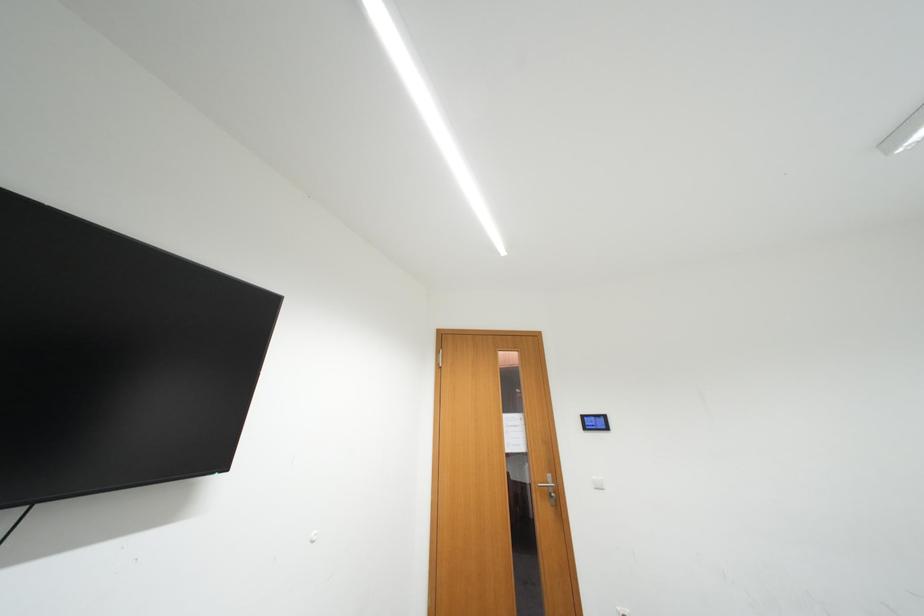
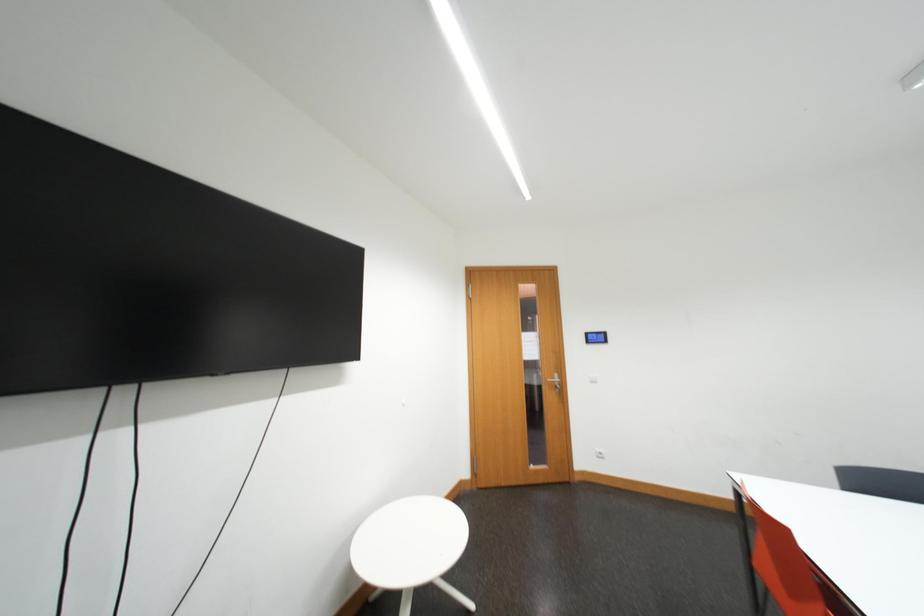
Question: How did the camera likely rotate?

Choices:
 (A) Left
 (B) Right
 (C) Up
 (D) Down

Answer: (D)